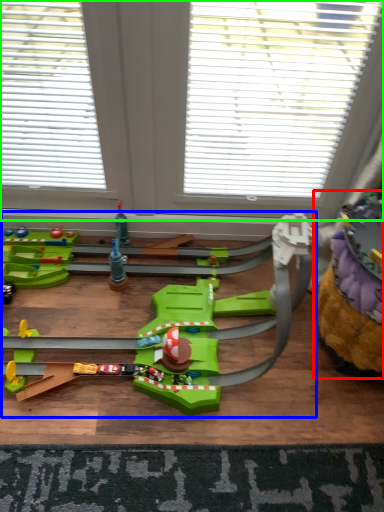
Question: Which is farther away from toy (highlighted by a red box)? toy (highlighted by a blue box) or window (highlighted by a green box)?

Choices:
 (A) toy
 (B) window

Answer: (B)